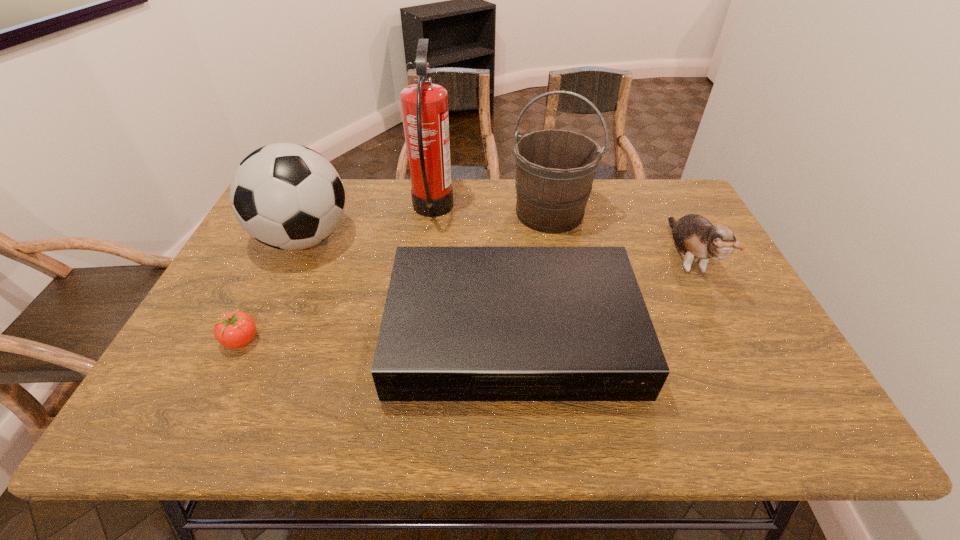
The image size is (960, 540). In order to click on fire extinguisher in this screenshot , I will do `click(424, 105)`.

The image size is (960, 540). I want to click on the second tallest object, so click(555, 169).

Where is `the third tallest object`? This screenshot has width=960, height=540. the third tallest object is located at coordinates (287, 196).

In order to click on cat in this screenshot , I will do `click(696, 238)`.

This screenshot has height=540, width=960. I want to click on the rightmost object, so click(x=696, y=238).

At what (x,y) coordinates should I click in order to perform the action: click on CD player. Please return your answer as a coordinate pair (x, y). The image size is (960, 540). Looking at the image, I should click on (460, 323).

Identify the location of the shortest object. (236, 329).

Identify the location of free space located 0.350m on the front-facing side of the tallest object. The image size is (960, 540). point(564,211).

Where is `blank space located on the left of the bucket`? This screenshot has width=960, height=540. blank space located on the left of the bucket is located at coordinates (494, 213).

The height and width of the screenshot is (540, 960). I want to click on free location located 0.160m on the right of the fourth shortest object, so click(x=407, y=239).